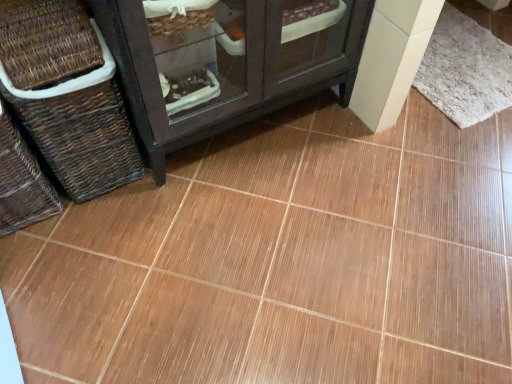
At what (x,y) coordinates should I click in order to perform the action: click on free space in front of brown woven basket at left, the first basket in the left-to-right sequence. Please return your answer as a coordinate pair (x, y). The image size is (512, 384). Looking at the image, I should click on (39, 262).